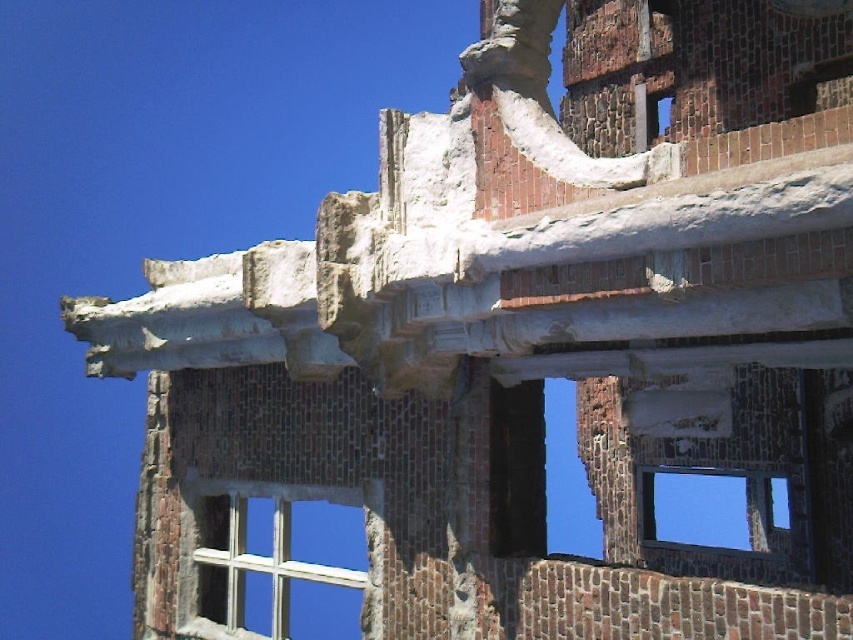
Question: Can you confirm if white wooden window at center is positioned above transparent glass window at center?

Choices:
 (A) yes
 (B) no

Answer: (A)

Question: Among these points, which one is farthest from the camera?

Choices:
 (A) (746, 481)
 (B) (213, 632)

Answer: (A)

Question: Can you confirm if white wooden window at center is thinner than transparent glass window at center?

Choices:
 (A) yes
 (B) no

Answer: (A)

Question: Can you confirm if white wooden window at center is positioned above transparent glass window at center?

Choices:
 (A) no
 (B) yes

Answer: (B)